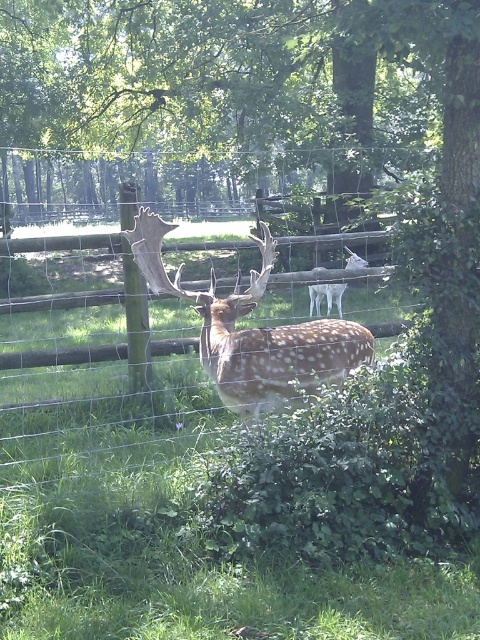
Question: Which point is farther to the camera?

Choices:
 (A) spotted fur antlers at center
 (B) fawn-patterned antlered deer at center

Answer: (A)

Question: Is wire mesh fence at center further to camera compared to fawn-patterned antlered deer at center?

Choices:
 (A) yes
 (B) no

Answer: (A)

Question: Is wire mesh fence at center closer to the viewer compared to fawn-patterned antlered deer at center?

Choices:
 (A) no
 (B) yes

Answer: (A)

Question: Does wire mesh fence at center have a lesser width compared to fawn-patterned antlered deer at center?

Choices:
 (A) yes
 (B) no

Answer: (A)

Question: Among these points, which one is farthest from the camera?

Choices:
 (A) click(x=12, y=488)
 (B) click(x=239, y=337)

Answer: (B)

Question: Which object appears farthest from the camera in this image?

Choices:
 (A) wire mesh fence at center
 (B) spotted fur antlers at center

Answer: (B)